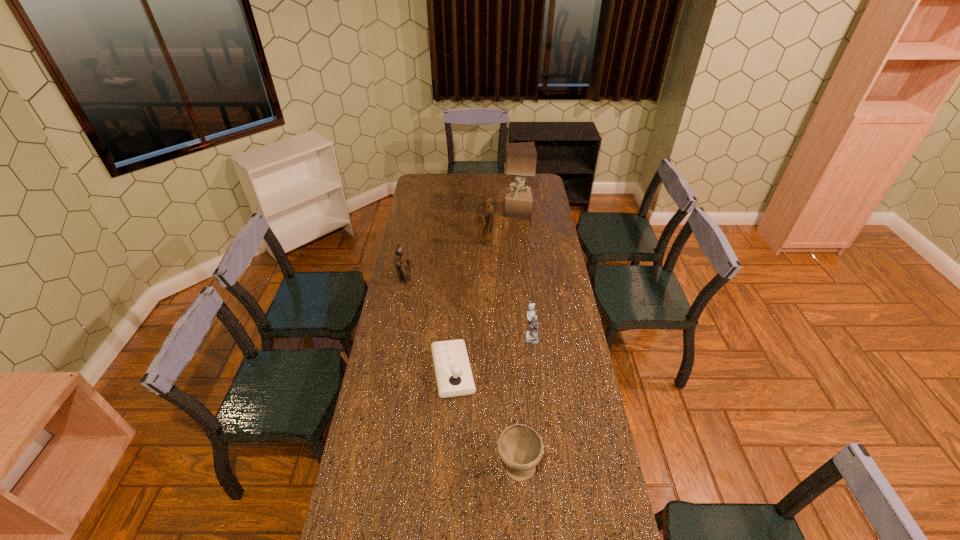
Image resolution: width=960 pixels, height=540 pixels. Identify the location of vacant space that satisfies the following two spatial constraints: 1. on the front-facing side of the second nearest figurine; 2. on the left side of the shortest object. (390, 372).

Where is `free space that satisfies the following two spatial constraints: 1. on the front-facing side of the second object from left to right; 2. on the left side of the leftmost figurine`? The image size is (960, 540). free space that satisfies the following two spatial constraints: 1. on the front-facing side of the second object from left to right; 2. on the left side of the leftmost figurine is located at coordinates (390, 372).

Locate an element on the screen. Image resolution: width=960 pixels, height=540 pixels. vacant space that satisfies the following two spatial constraints: 1. on the front-facing side of the third farthest object; 2. on the left side of the chalice is located at coordinates (372, 468).

Identify the location of vacant region that satisfies the following two spatial constraints: 1. on the front-facing side of the chalice; 2. on the left side of the fifth nearest object. (489, 468).